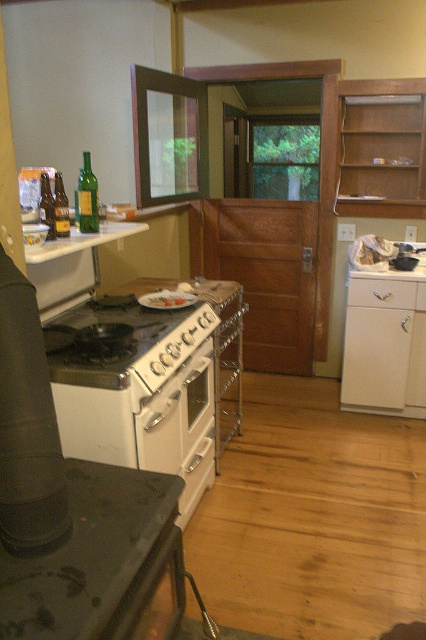
Is the position of white matte plate at center less distant than that of white glossy plate at center?

Yes, it is in front of white glossy plate at center.

Which of these two, white matte plate at center or white glossy plate at center, stands shorter?

With less height is white glossy plate at center.

I want to click on white matte plate at center, so click(166, 300).

Which is behind, point (32, 529) or point (173, 296)?

Point (173, 296)

Which of these two, black matte exhaust hood at lower left or white matte plate at center, stands taller?

black matte exhaust hood at lower left is taller.

Is point (9, 529) more distant than point (143, 298)?

No, (9, 529) is closer to viewer.

Locate an element on the screen. This screenshot has width=426, height=640. black matte exhaust hood at lower left is located at coordinates (28, 426).

Between white glossy gas stove at center and white matte plate at center, which one is positioned higher?

white matte plate at center is higher up.

Is white glossy gas stove at center to the right of white matte plate at center from the viewer's perspective?

Incorrect, white glossy gas stove at center is not on the right side of white matte plate at center.

This screenshot has width=426, height=640. What are the coordinates of `white glossy gas stove at center` in the screenshot? It's located at (123, 342).